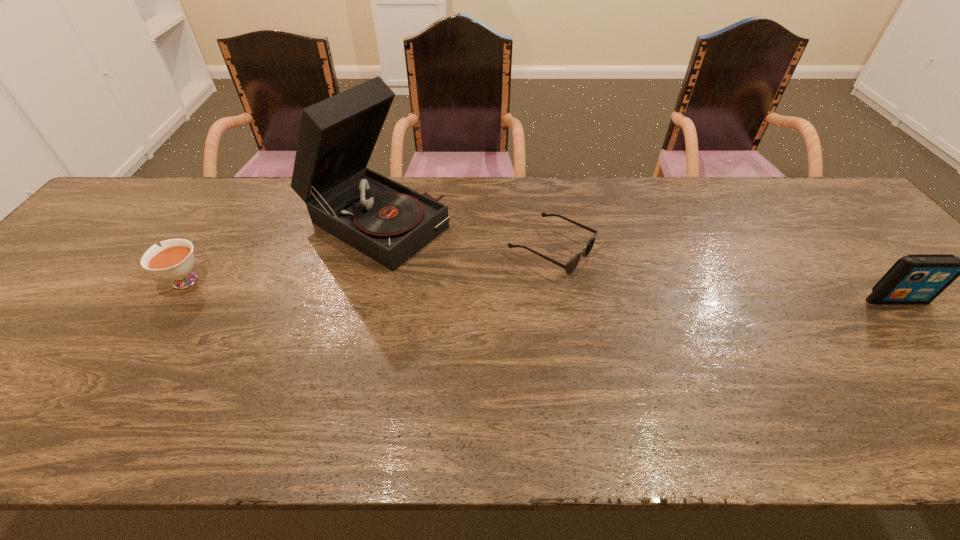
Image resolution: width=960 pixels, height=540 pixels. Find the location of `free space located on the side of the second shortest object with the handle`. free space located on the side of the second shortest object with the handle is located at coordinates (86, 281).

The height and width of the screenshot is (540, 960). Find the location of `free space located on the front screen of the second tallest object`. free space located on the front screen of the second tallest object is located at coordinates (x=930, y=339).

I want to click on free region located on the front-facing side of the phonograph_record, so click(542, 310).

Image resolution: width=960 pixels, height=540 pixels. What are the coordinates of `free space located 0.260m on the front-facing side of the phonograph_record` in the screenshot? It's located at (511, 293).

This screenshot has height=540, width=960. What are the coordinates of `blank space located 0.200m on the front-facing side of the phonograph_record` in the screenshot? It's located at (492, 283).

Identify the location of vacant area situated 0.400m on the front lenses of the sunglasses. (753, 348).

Locate an element on the screen. vacant space positioned on the front lenses of the sunglasses is located at coordinates (658, 301).

Locate an element on the screen. vacant position located 0.200m on the front lenses of the sunglasses is located at coordinates (665, 305).

The image size is (960, 540). Identify the location of phonograph_record positioned at the far edge. (388, 222).

Identify the location of sunglasses present at the far edge. (572, 264).